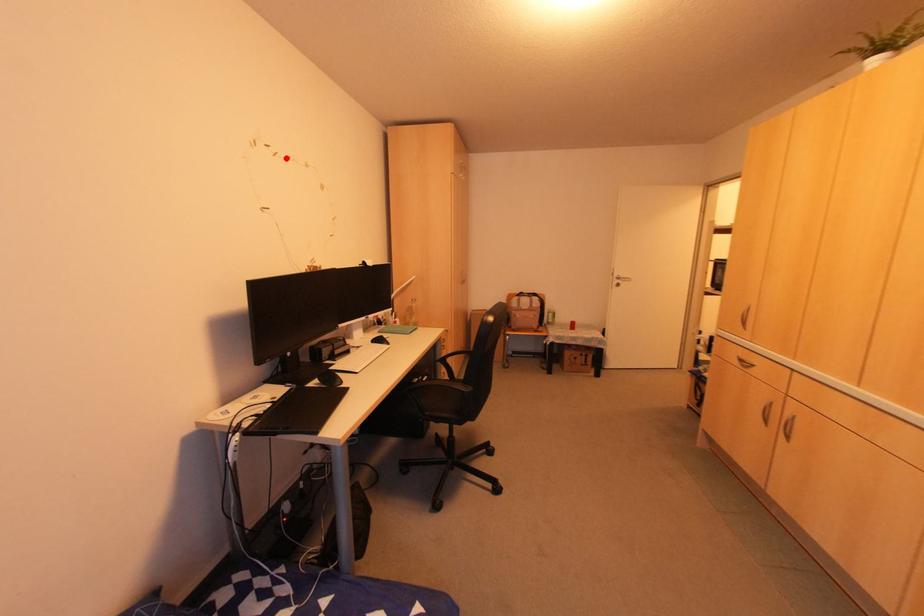
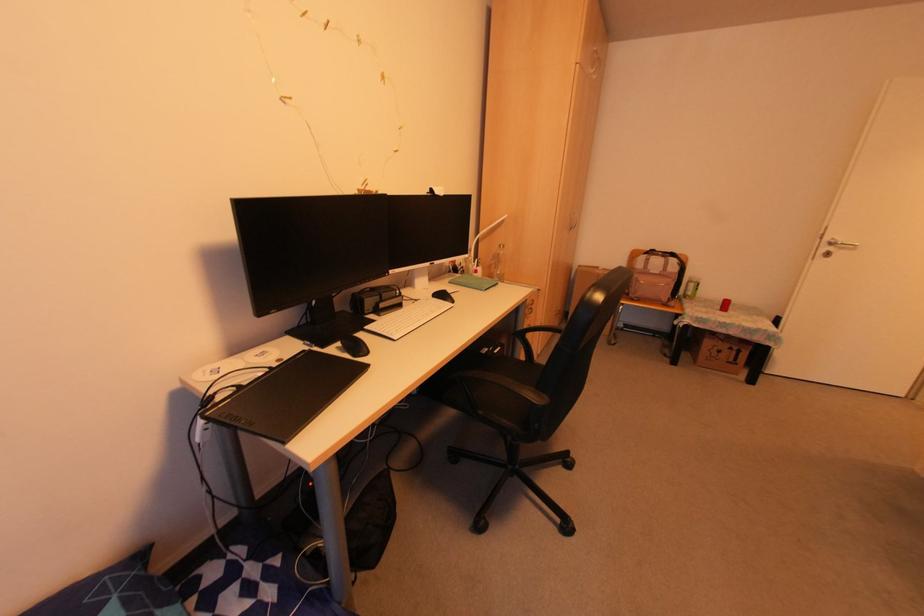
The point at the highlighted location is marked in the first image. Where is the corresponding point in the second image?

(324, 22)